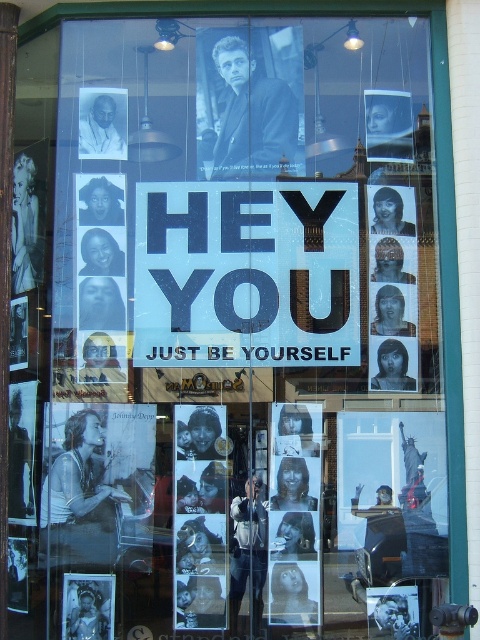
Question: Is the position of white glossy photo at center less distant than that of gray textured portrait at center?

Choices:
 (A) yes
 (B) no

Answer: (A)

Question: Which of the following is the farthest from the observer?

Choices:
 (A) matte black poster at center
 (B) black matte poster at right
 (C) black paper sign at center

Answer: (B)

Question: Does white glossy photo at center have a smaller size compared to matte black portrait at upper left?

Choices:
 (A) yes
 (B) no

Answer: (B)

Question: Estimate the real-world distances between objects in this image. Which object is farther from the white glossy photo at center?

Choices:
 (A) black matte poster at right
 (B) matte black poster at center

Answer: (A)

Question: Which point appears closest to the camera in this image?

Choices:
 (A) (225, 54)
 (B) (91, 128)
 (C) (239, 340)

Answer: (C)

Question: Does matte black portrait at upper left appear on the left side of gray textured portrait at center?

Choices:
 (A) no
 (B) yes

Answer: (B)